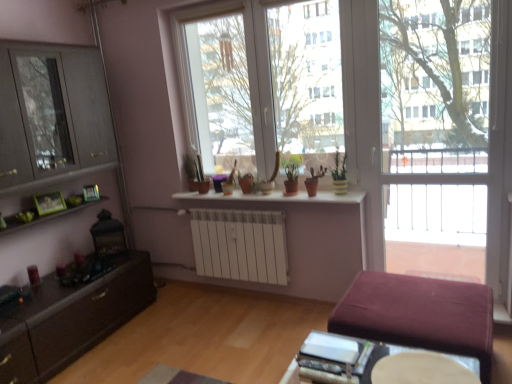
Locate an element on the screen. light brown wooden table at lower center is located at coordinates (422, 369).

Describe the element at coordinates (91, 193) in the screenshot. I see `green matte picture frame at left, the 2th picture frame positioned from the left` at that location.

What do you see at coordinates (196, 174) in the screenshot? This screenshot has width=512, height=384. I see `matte brown pot at center, arranged as the fourth houseplant when viewed from the right` at bounding box center [196, 174].

Image resolution: width=512 pixels, height=384 pixels. I want to click on brushed metal entertainment center at left, so click(52, 120).

What is the approximate width of green matte plant at center, which is the first houseplant from right to left?

green matte plant at center, which is the first houseplant from right to left, is 6.03 inches wide.

You are a GUI agent. You are given a task and a screenshot of the screen. Output one action in this format:
    pyautogui.click(x=<x>, y=<y>)
    Task: Click on the green matte picture frame at left, arranged as the first picture frame when viewed from the front
    
    Given the screenshot: What is the action you would take?
    pyautogui.click(x=49, y=203)

How much distance is there between matte gray cabinet at left and brushed metal entertainment center at left?

matte gray cabinet at left is 3.13 centimeters from brushed metal entertainment center at left.

Does matte gray cabinet at left turn towards brushed metal entertainment center at left?

No, matte gray cabinet at left is not facing towards brushed metal entertainment center at left.

Can you confirm if matte gray cabinet at left is bigger than brushed metal entertainment center at left?

Correct, matte gray cabinet at left is larger in size than brushed metal entertainment center at left.

How different are the orientations of matte gray cabinet at left and brushed metal entertainment center at left in degrees?

The angle between the facing direction of matte gray cabinet at left and the facing direction of brushed metal entertainment center at left is 0.00269 degrees.

From the image's perspective, which is below, matte gray cabinet at left or green matte picture frame at left, the 2th picture frame positioned from the left?

green matte picture frame at left, the 2th picture frame positioned from the left, from the image's perspective.

Between matte gray cabinet at left and green matte picture frame at left, placed as the 1th picture frame when sorted from right to left, which one has smaller size?

Smaller between the two is green matte picture frame at left, placed as the 1th picture frame when sorted from right to left.

Is matte gray cabinet at left at the right side of green matte picture frame at left, the 2th picture frame positioned from the left?

In fact, matte gray cabinet at left is to the left of green matte picture frame at left, the 2th picture frame positioned from the left.

From a real-world perspective, is matte brown pot at center, positioned as the 2th houseplant in right-to-left order, beneath velvet maroon ottoman at lower right?

Incorrect, from a real-world perspective, matte brown pot at center, positioned as the 2th houseplant in right-to-left order, is higher than velvet maroon ottoman at lower right.

In the scene shown: Does matte brown pot at center, arranged as the third houseplant when viewed from the left, touch velvet maroon ottoman at lower right?

There is a gap between matte brown pot at center, arranged as the third houseplant when viewed from the left, and velvet maroon ottoman at lower right.

Can you confirm if matte brown pot at center, arranged as the third houseplant when viewed from the left, is positioned to the left of velvet maroon ottoman at lower right?

Correct, you'll find matte brown pot at center, arranged as the third houseplant when viewed from the left, to the left of velvet maroon ottoman at lower right.

From a real-world perspective, starting from the velvet maroon ottoman at lower right, which houseplant is the 1st one vertically above it? Please provide its 2D coordinates.

[(314, 180)]

Between white ceramic pots at center and brushed metal entertainment center at left, which one appears on the right side from the viewer's perspective?

Positioned to the right is white ceramic pots at center.

Considering the points (326, 193) and (19, 98), which point is in front, point (326, 193) or point (19, 98)?

Positioned in front is point (19, 98).

Can you see white ceramic pots at center touching brushed metal entertainment center at left?

No, white ceramic pots at center is not touching brushed metal entertainment center at left.

Is green matte picture frame at left, the 2th picture frame positioned from the left, positioned with its back to white ceramic pots at center?

No.

Is the surface of green matte picture frame at left, placed as the 1th picture frame when sorted from right to left, in direct contact with white ceramic pots at center?

green matte picture frame at left, placed as the 1th picture frame when sorted from right to left, and white ceramic pots at center are clearly separated.

Is green matte picture frame at left, placed as the 1th picture frame when sorted from right to left, wider than white ceramic pots at center?

No.

Which is behind, point (97, 185) or point (316, 198)?

The point (97, 185) is more distant.

Does velvet maroon ottoman at lower right have a larger size compared to transparent glass window at center?

Yes.

Considering the relative positions of velvet maroon ottoman at lower right and transparent glass window at center in the image provided, is velvet maroon ottoman at lower right to the left of transparent glass window at center from the viewer's perspective?

No.

Considering the positions of points (370, 305) and (321, 3), is point (370, 305) closer to camera compared to point (321, 3)?

Yes.

Which object is closer to the camera taking this photo, velvet maroon ottoman at lower right or transparent glass window at center?

velvet maroon ottoman at lower right.

Considering the sizes of objects white ceramic pots at center and matte brown pot at center, the 1th houseplant positioned from the left, in the image provided, who is shorter, white ceramic pots at center or matte brown pot at center, the 1th houseplant positioned from the left,?

Standing shorter between the two is white ceramic pots at center.

Is white ceramic pots at center wider or thinner than matte brown pot at center, the 1th houseplant positioned from the left?

white ceramic pots at center is wider than matte brown pot at center, the 1th houseplant positioned from the left.

In the scene shown: Is white ceramic pots at center bigger or smaller than matte brown pot at center, the 1th houseplant positioned from the left?

Considering their sizes, white ceramic pots at center takes up more space than matte brown pot at center, the 1th houseplant positioned from the left.

Who is more distant, white ceramic pots at center or matte brown pot at center, the 1th houseplant positioned from the left?

Positioned behind is matte brown pot at center, the 1th houseplant positioned from the left.

At what (x,y) coordinates should I click in order to perform the action: click on cabinet that appears in front of the brushed metal entertainment center at left. Please return your answer as a coordinate pair (x, y). The height and width of the screenshot is (384, 512). Looking at the image, I should click on click(52, 115).

You are a GUI agent. You are given a task and a screenshot of the screen. Output one action in this format:
    pyautogui.click(x=<x>, y=<y>)
    Task: Click on the picture frame on the right side of matte gray cabinet at left
    This screenshot has width=512, height=384.
    Given the screenshot: What is the action you would take?
    pyautogui.click(x=91, y=193)

Looking at the image, which one is located closer to light brown wooden table at lower center, green matte plant at center, which is the first houseplant from right to left, or velvet maroon ottoman at lower right?

Among the two, velvet maroon ottoman at lower right is located nearer to light brown wooden table at lower center.

Considering their positions, is green matte plant at center, which is the first houseplant from right to left, positioned closer to transparent glass screen door at right than transparent glass window at center?

green matte plant at center, which is the first houseplant from right to left, is closer to transparent glass screen door at right.

Based on the photo, based on their spatial positions, is green matte plant at center, the fourth houseplant from the left, or matte gray cabinet at left further from matte brown pot at center, the 1th houseplant positioned from the left?

The object further to matte brown pot at center, the 1th houseplant positioned from the left, is green matte plant at center, the fourth houseplant from the left.

Considering their positions, is matte gray cabinet at left positioned closer to light brown wooden table at lower center than velvet maroon ottoman at lower right?

The object closer to light brown wooden table at lower center is velvet maroon ottoman at lower right.

Estimate the real-world distances between objects in this image. Which object is further from green matte picture frame at left, the first picture frame from the left, green matte picture frame at left, which is the first picture frame in back-to-front order, or light brown wooden table at lower center?

light brown wooden table at lower center is further to green matte picture frame at left, the first picture frame from the left.

Considering their positions, is matte brown pot at center, arranged as the fourth houseplant when viewed from the right, positioned closer to green matte plant at center, which is the first houseplant from right to left, than matte brown pot at center, positioned as the 2th houseplant in right-to-left order?

matte brown pot at center, positioned as the 2th houseplant in right-to-left order, is positioned closer to the anchor green matte plant at center, which is the first houseplant from right to left.

Based on their spatial positions, is green matte picture frame at left, the first picture frame from the left, or matte gray cabinet at left further from transparent glass window at center?

green matte picture frame at left, the first picture frame from the left, lies further to transparent glass window at center than the other object.

Estimate the real-world distances between objects in this image. Which object is further from white ceramic pots at center, velvet maroon ottoman at lower right or matte gray cabinet at left?

matte gray cabinet at left lies further to white ceramic pots at center than the other object.

What are the coordinates of `window sill between light brown wooden table at lower center and matte brown pot at center, the 1th houseplant positioned from the left, from front to back` in the screenshot? It's located at (275, 197).

Where is `window sill between transparent glass window at center and velvet maroon ottoman at lower right in the up-down direction`? The height and width of the screenshot is (384, 512). window sill between transparent glass window at center and velvet maroon ottoman at lower right in the up-down direction is located at coordinates (275, 197).

At what (x,y) coordinates should I click in order to perform the action: click on picture frame between matte gray cabinet at left and transparent glass window at center in the horizontal direction. Please return your answer as a coordinate pair (x, y). The image size is (512, 384). Looking at the image, I should click on (91, 193).

In order to click on cabinet situated between brushed metal entertainment center at left and matte brown pot at center, the 1th houseplant positioned from the left, from left to right in this screenshot , I will do `click(52, 115)`.